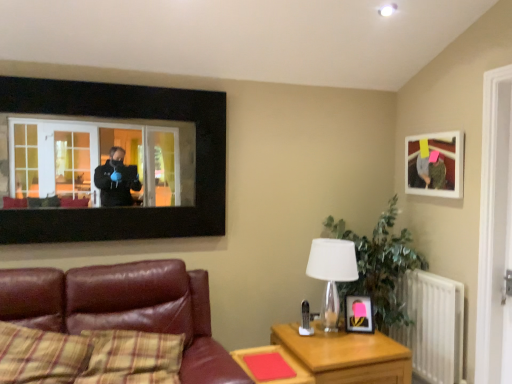
Question: Is black matte window frame at upper left not within white metallic radiator at right?

Choices:
 (A) yes
 (B) no

Answer: (A)

Question: Is black matte window frame at upper left far away from white metallic radiator at right?

Choices:
 (A) yes
 (B) no

Answer: (A)

Question: Is white metallic radiator at right located within black matte window frame at upper left?

Choices:
 (A) no
 (B) yes

Answer: (A)

Question: Is black matte window frame at upper left turned away from white metallic radiator at right?

Choices:
 (A) no
 (B) yes

Answer: (A)

Question: From a real-world perspective, is black matte window frame at upper left located beneath white metallic radiator at right?

Choices:
 (A) yes
 (B) no

Answer: (B)

Question: Is wooden table at lower center, which is the 2th table from right to left, bigger or smaller than white metallic radiator at right?

Choices:
 (A) big
 (B) small

Answer: (B)

Question: Is wooden table at lower center, which is the first table in left-to-right order, in front of or behind white metallic radiator at right in the image?

Choices:
 (A) behind
 (B) front

Answer: (B)

Question: Is wooden table at lower center, which is the first table in left-to-right order, to the left or to the right of white metallic radiator at right in the image?

Choices:
 (A) right
 (B) left

Answer: (B)

Question: From the image's perspective, is wooden table at lower center, which is the 2th table from right to left, located above or below white metallic radiator at right?

Choices:
 (A) above
 (B) below

Answer: (B)

Question: From the image's perspective, relative to matte white picture frame at upper right, which ranks as the 1th picture frame in right-to-left order, is matte black picture frame at center, which appears as the 2th picture frame when viewed from the top, above or below?

Choices:
 (A) above
 (B) below

Answer: (B)

Question: In terms of height, does matte black picture frame at center, the first picture frame from the bottom, look taller or shorter compared to matte white picture frame at upper right, acting as the second picture frame starting from the bottom?

Choices:
 (A) short
 (B) tall

Answer: (A)

Question: Is matte black picture frame at center, the first picture frame from the bottom, spatially inside matte white picture frame at upper right, which ranks as the 1th picture frame in right-to-left order, or outside of it?

Choices:
 (A) outside
 (B) inside

Answer: (A)

Question: Relative to matte white picture frame at upper right, acting as the second picture frame starting from the bottom, is matte black picture frame at center, which appears as the 2th picture frame when viewed from the top, in front or behind?

Choices:
 (A) front
 (B) behind

Answer: (B)

Question: Is leather couch at lower left bigger or smaller than matte white picture frame at upper right, which is the second picture frame from left to right?

Choices:
 (A) small
 (B) big

Answer: (B)

Question: Visually, is leather couch at lower left positioned to the left or to the right of matte white picture frame at upper right, marked as the 1th picture frame in a top-to-bottom arrangement?

Choices:
 (A) left
 (B) right

Answer: (A)